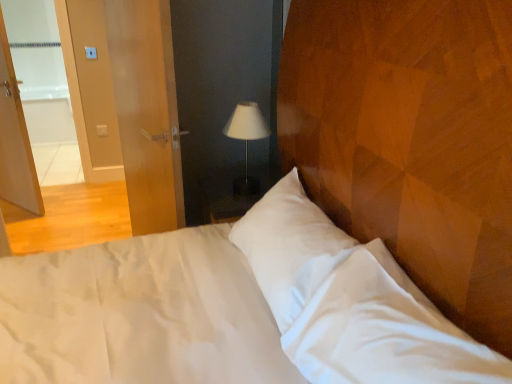
Question: Looking at their shapes, would you say white plastic light switch at upper left is wider or thinner than white fabric lampshade at center?

Choices:
 (A) thin
 (B) wide

Answer: (A)

Question: From the image's perspective, is white plastic light switch at upper left positioned above or below white fabric lampshade at center?

Choices:
 (A) above
 (B) below

Answer: (A)

Question: Which object is the farthest from the matte wood door at left?

Choices:
 (A) white plastic light switch at upper left
 (B) white fabric lampshade at center

Answer: (A)

Question: Considering the real-world distances, which object is farthest from the white fabric lampshade at center?

Choices:
 (A) matte wood door at left
 (B) white plastic light switch at upper left

Answer: (B)